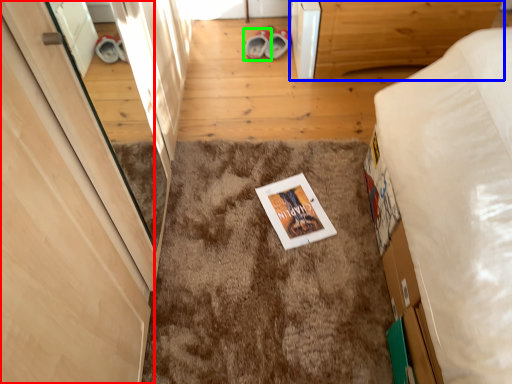
Question: Based on their relative distances, which object is nearer to door (highlighted by a red box)? Choose from furniture (highlighted by a blue box) and footwear (highlighted by a green box).

Choices:
 (A) furniture
 (B) footwear

Answer: (A)